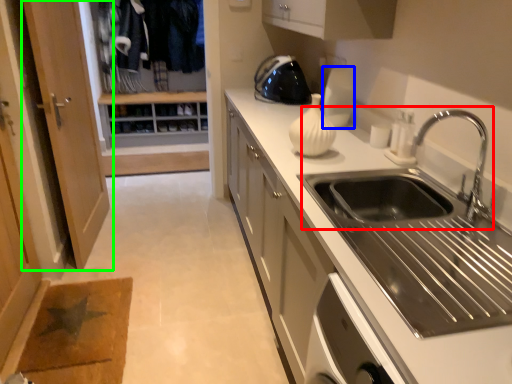
Question: Which object is positioned farthest from sink (highlighted by a red box)? Select from appliance (highlighted by a blue box) and door (highlighted by a green box).

Choices:
 (A) appliance
 (B) door

Answer: (B)